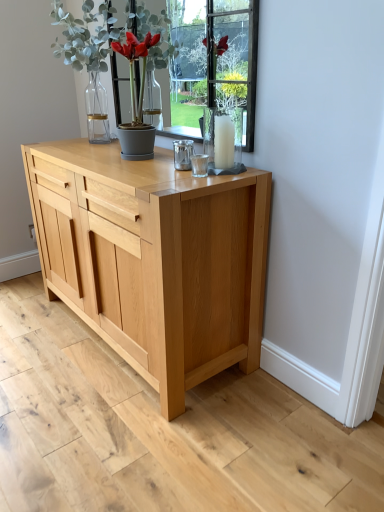
Identify the location of vacant space situated on the left part of natural wood chest of drawers at center. 34,338.